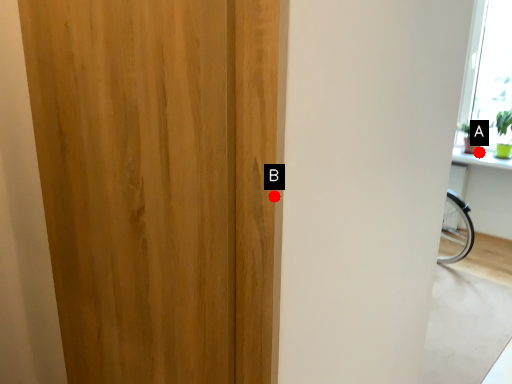
Question: Two points are circled on the image, labeled by A and B beside each circle. Which point is farther from the camera taking this photo?

Choices:
 (A) A is further
 (B) B is further

Answer: (A)